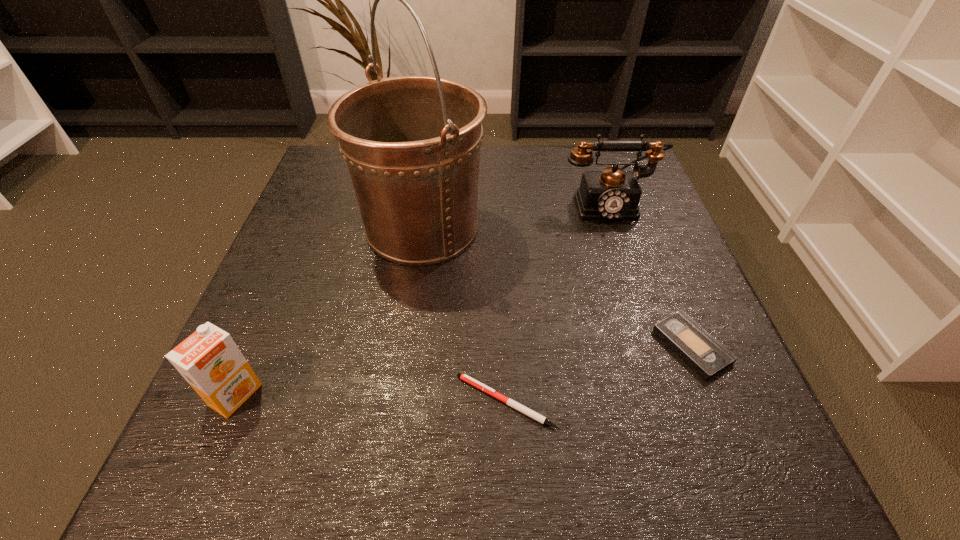
Locate an element on the screen. The image size is (960, 540). the tallest object is located at coordinates (412, 144).

Image resolution: width=960 pixels, height=540 pixels. I want to click on the second tallest object, so click(612, 194).

You are a GUI agent. You are given a task and a screenshot of the screen. Output one action in this format:
    pyautogui.click(x=<x>, y=<y>)
    Task: Click on the third tallest object
    
    Given the screenshot: What is the action you would take?
    pyautogui.click(x=209, y=360)

What are the coordinates of `orange juice` in the screenshot? It's located at (209, 360).

This screenshot has width=960, height=540. Find the location of `videotape`. videotape is located at coordinates (706, 355).

Locate an element on the screen. pen is located at coordinates (464, 377).

Where is `free location located on the right of the tallest object`? free location located on the right of the tallest object is located at coordinates (664, 227).

Locate an element on the screen. The width and height of the screenshot is (960, 540). free space located 0.130m on the front of the telephone at the rotary dial is located at coordinates (628, 265).

Locate an element on the screen. free space located 0.080m on the right of the third shortest object is located at coordinates (311, 395).

The image size is (960, 540). Identify the location of vacant space located on the left of the second shortest object. (513, 346).